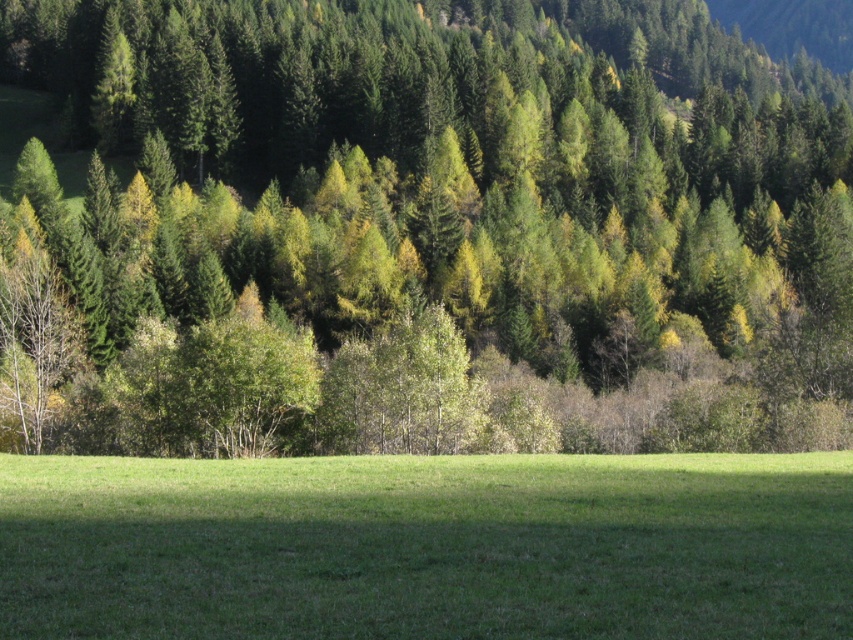
Question: Can you confirm if green matte tree at upper center is positioned to the right of green grassy field at center?

Choices:
 (A) yes
 (B) no

Answer: (A)

Question: Is green matte tree at upper center closer to the viewer compared to green grassy field at center?

Choices:
 (A) no
 (B) yes

Answer: (A)

Question: Is green matte tree at upper center to the left of green grassy field at center from the viewer's perspective?

Choices:
 (A) yes
 (B) no

Answer: (B)

Question: Among these objects, which one is nearest to the camera?

Choices:
 (A) green grassy field at center
 (B) green matte tree at upper center

Answer: (A)

Question: Which of the following is the closest to the observer?

Choices:
 (A) (592, 586)
 (B) (299, 145)

Answer: (A)